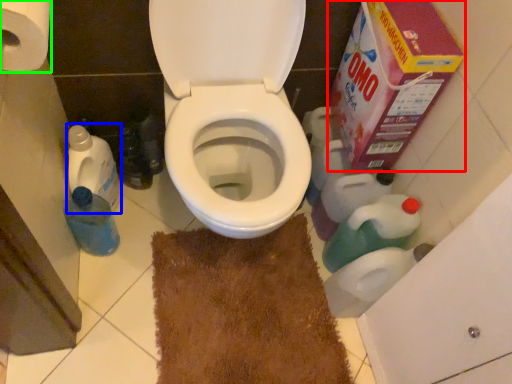
Question: Estimate the real-world distances between objects in this image. Which object is farther from cardboard box (highlighted by a red box), cleaning product (highlighted by a blue box) or toilet paper (highlighted by a green box)?

Choices:
 (A) cleaning product
 (B) toilet paper

Answer: (A)